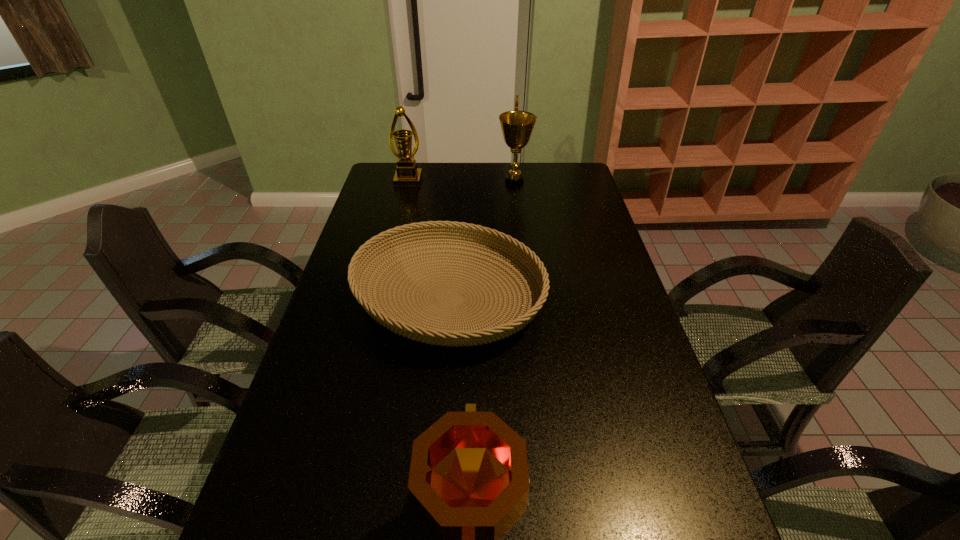
Locate an element on the screen. The height and width of the screenshot is (540, 960). the leftmost award is located at coordinates (407, 174).

The width and height of the screenshot is (960, 540). In order to click on the second nearest object in this screenshot , I will do `click(490, 329)`.

The image size is (960, 540). I want to click on the shortest object, so click(x=490, y=329).

I want to click on vacant space situated 0.300m on the front-facing side of the leftmost award, so click(x=396, y=227).

Find the location of `vacant space located on the right of the third farthest object`. vacant space located on the right of the third farthest object is located at coordinates (578, 299).

The image size is (960, 540). In order to click on award located at the left edge in this screenshot , I will do `click(407, 174)`.

Find the location of a particular element. basket at the left edge is located at coordinates (490, 329).

This screenshot has width=960, height=540. Find the location of `object that is at the far left corner`. object that is at the far left corner is located at coordinates (407, 174).

Where is `blank space at the far edge of the desktop`? This screenshot has width=960, height=540. blank space at the far edge of the desktop is located at coordinates (533, 171).

This screenshot has height=540, width=960. Identify the location of free space at the left edge of the desktop. (374, 336).